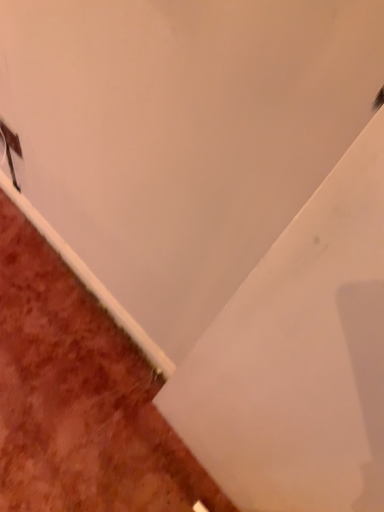
What do you see at coordinates (12, 149) in the screenshot?
I see `matte brown outlet at upper left` at bounding box center [12, 149].

Identify the location of matte brown outlet at upper left. The height and width of the screenshot is (512, 384). click(x=12, y=149).

I want to click on matte brown outlet at upper left, so click(x=12, y=149).